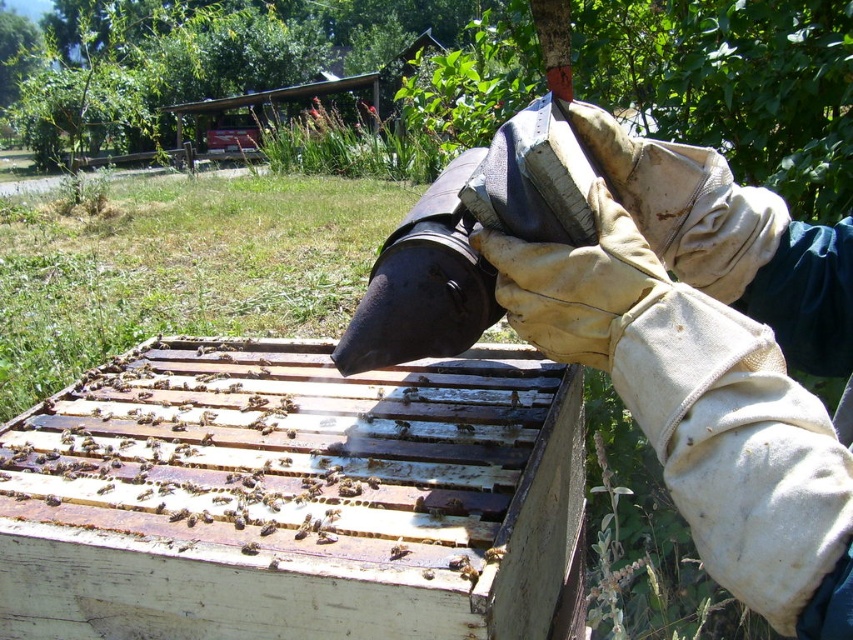
You are a beekeeper standing in front of the hive and need to reach two points marked in the image. One is at point (468, 433) and the other at point (515, 397). Which point should you reach first to minimize the distance walked?

Point (468, 433) is closer to the viewer than point (515, 397), so you should reach point (468, 433) first to minimize the distance walked.

In the scene shown: You are a beekeeper standing at the point marked by coordinates point (293, 497). You need to move towards the wooden beehive at center. Is the wooden beehive at center located directly in front of you?

The point (293, 497) marks the wooden beehive at center, so you are already at the location of the wooden beehive at center. Therefore, the wooden beehive at center is not located in front of you but directly where you are standing.